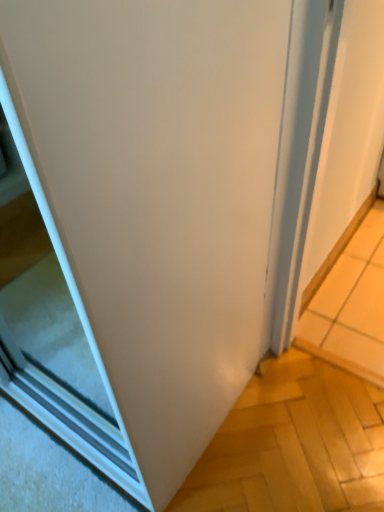
Locate an element on the screen. yellow tile at right is located at coordinates (351, 306).

The height and width of the screenshot is (512, 384). What do you see at coordinates (351, 306) in the screenshot?
I see `yellow tile at right` at bounding box center [351, 306].

What is the approximate height of yellow tile at right?

yellow tile at right is 2.77 inches tall.

In order to face yellow tile at right, should I rotate leftwards or rightwards?

Turn right approximately 20.101 degrees to face it.

Where is `yellow tile at right`? The width and height of the screenshot is (384, 512). yellow tile at right is located at coordinates (351, 306).